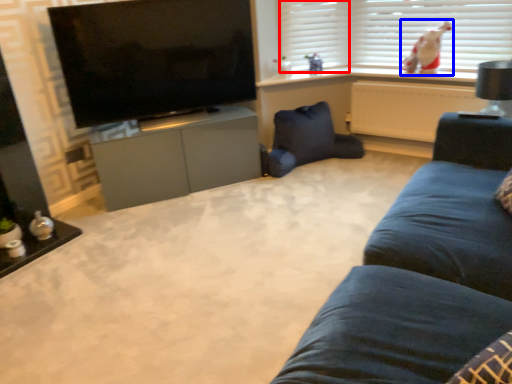
Question: Which point is closer to the camera, shutter (highlighted by a red box) or person (highlighted by a blue box)?

Choices:
 (A) shutter
 (B) person

Answer: (B)